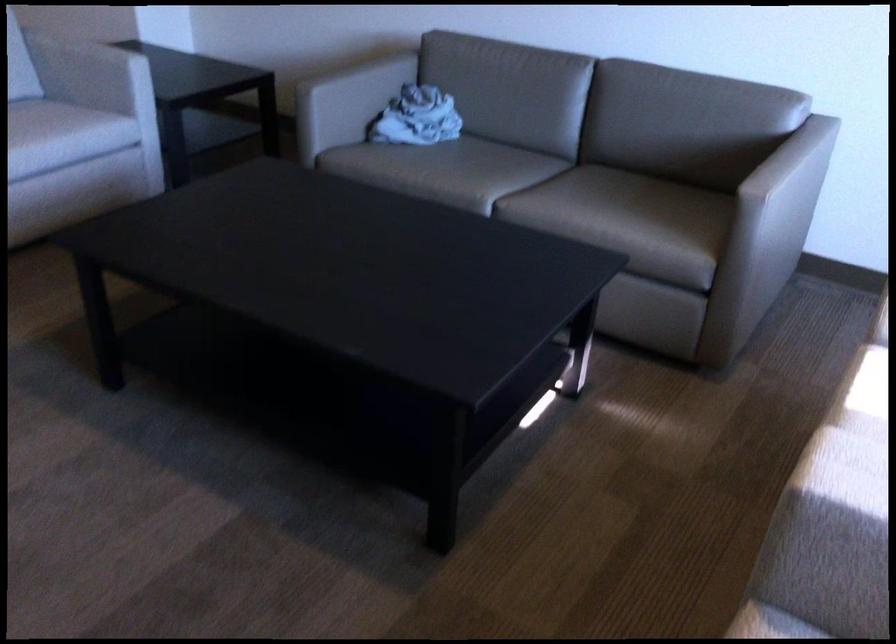
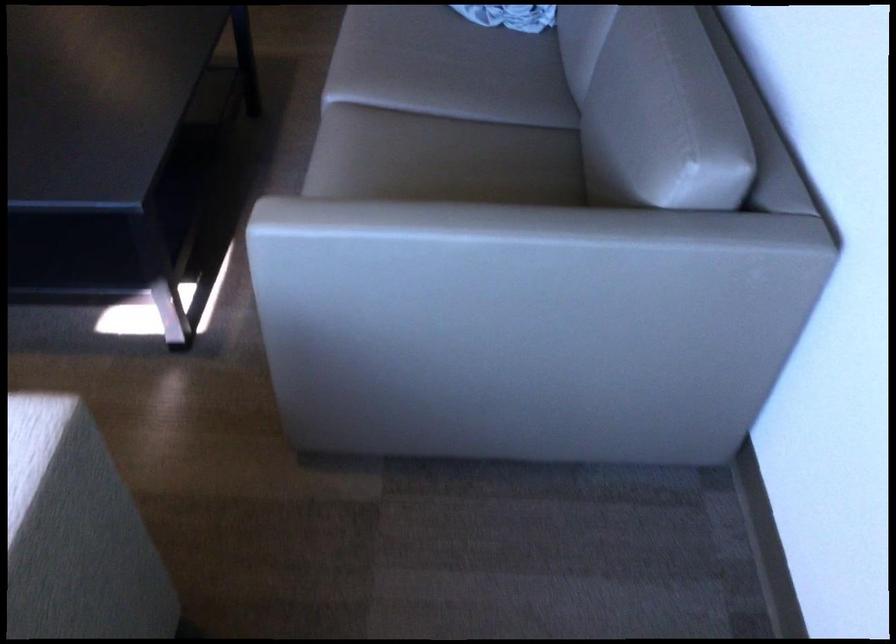
Find the pixel in the second image that matches (483,162) in the first image.

(463, 73)